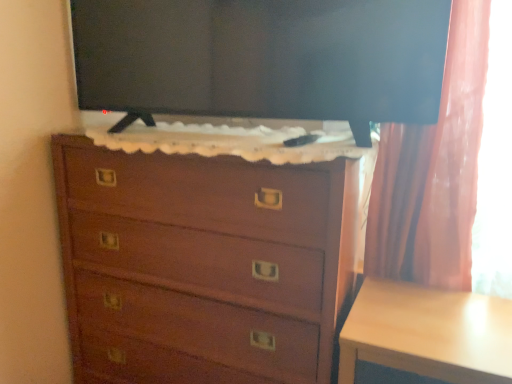
Question: Is light wood table at lower right looking in the opposite direction of black glossy tv at upper center?

Choices:
 (A) yes
 (B) no

Answer: (B)

Question: Is light wood table at lower right outside of black glossy tv at upper center?

Choices:
 (A) no
 (B) yes

Answer: (B)

Question: Are light wood table at lower right and black glossy tv at upper center making contact?

Choices:
 (A) yes
 (B) no

Answer: (B)

Question: From a real-world perspective, is light wood table at lower right beneath black glossy tv at upper center?

Choices:
 (A) no
 (B) yes

Answer: (B)

Question: Can you confirm if light wood table at lower right is wider than black glossy tv at upper center?

Choices:
 (A) yes
 (B) no

Answer: (A)

Question: In terms of height, does light wood table at lower right look taller or shorter compared to wooden chest of drawers at center?

Choices:
 (A) short
 (B) tall

Answer: (A)

Question: Looking at the image, does light wood table at lower right seem bigger or smaller compared to wooden chest of drawers at center?

Choices:
 (A) big
 (B) small

Answer: (B)

Question: From a real-world perspective, relative to wooden chest of drawers at center, is light wood table at lower right vertically above or below?

Choices:
 (A) below
 (B) above

Answer: (A)

Question: In the image, is light wood table at lower right positioned in front of or behind wooden chest of drawers at center?

Choices:
 (A) behind
 (B) front

Answer: (B)

Question: Considering the positions of wooden chest of drawers at center and black glossy tv at upper center in the image, is wooden chest of drawers at center wider or thinner than black glossy tv at upper center?

Choices:
 (A) wide
 (B) thin

Answer: (A)

Question: Looking at the image, does wooden chest of drawers at center seem bigger or smaller compared to black glossy tv at upper center?

Choices:
 (A) big
 (B) small

Answer: (A)

Question: Does point (168, 377) appear closer or farther from the camera than point (275, 24)?

Choices:
 (A) farther
 (B) closer

Answer: (A)

Question: Would you say wooden chest of drawers at center is to the left or to the right of black glossy tv at upper center in the picture?

Choices:
 (A) right
 (B) left

Answer: (B)

Question: Would you say black glossy tv at upper center is inside or outside wooden chest of drawers at center?

Choices:
 (A) outside
 (B) inside

Answer: (A)

Question: In terms of width, does black glossy tv at upper center look wider or thinner when compared to wooden chest of drawers at center?

Choices:
 (A) thin
 (B) wide

Answer: (A)